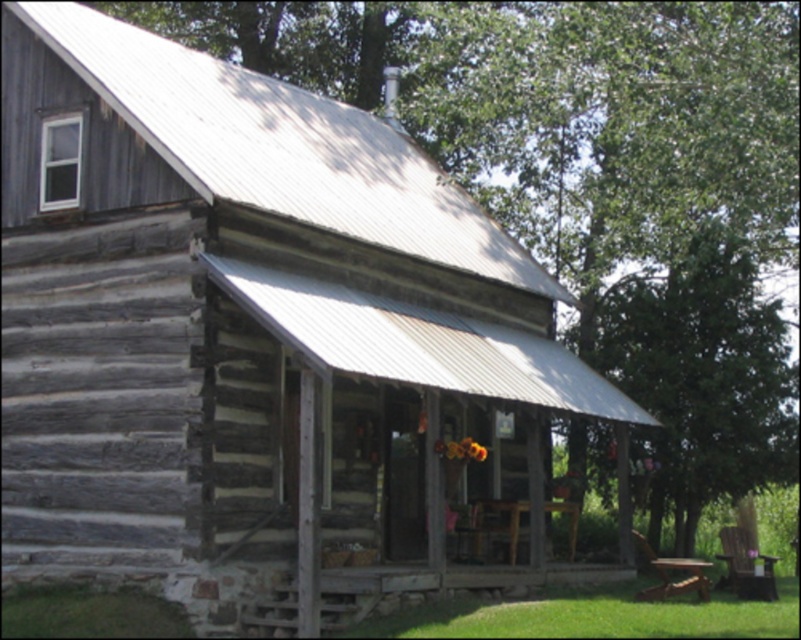
Does green leafy tree at center appear over wooden picnic table at center?

Indeed, green leafy tree at center is positioned over wooden picnic table at center.

Does point (719, 404) lie behind point (578, 513)?

Yes, point (719, 404) is farther from viewer.

Measure the distance between point (721, 317) and camera.

Point (721, 317) and camera are 32.09 meters apart from each other.

The image size is (801, 640). I want to click on green leafy tree at center, so click(699, 378).